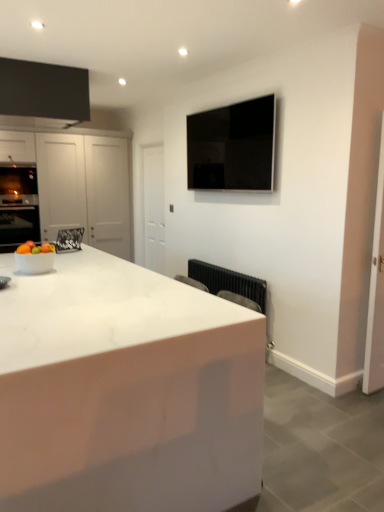
In order to face black glossy tv at upper center, should I rotate leftwards or rightwards?

It's best to rotate right around 4.133 degrees.

Where is `shiny white bowl at left`? The width and height of the screenshot is (384, 512). shiny white bowl at left is located at coordinates (35, 248).

What is the approximate width of black metallic radiator at lower center?

It is 6.21 inches.

The height and width of the screenshot is (512, 384). Find the location of `white glossy cabinet at left`. white glossy cabinet at left is located at coordinates (86, 189).

The height and width of the screenshot is (512, 384). In order to click on white marble countertop at center in this screenshot , I will do `click(126, 390)`.

Looking at their sizes, would you say white glossy cabinet at left is wider or thinner than white marble countertop at center?

white glossy cabinet at left is thinner than white marble countertop at center.

Which of these two, white glossy cabinet at left or white marble countertop at center, is smaller?

Smaller between the two is white glossy cabinet at left.

Is point (39, 144) closer or farther from the camera than point (40, 490)?

Point (39, 144) is positioned farther from the camera compared to point (40, 490).

How different are the orientations of white glossy cabinet at left and white marble countertop at center in degrees?

There is a 0.356-degree angle between the facing directions of white glossy cabinet at left and white marble countertop at center.

Which is more to the right, white glossy cabinet at left or shiny white bowl at left?

From the viewer's perspective, shiny white bowl at left appears more on the right side.

How many degrees apart are the facing directions of white glossy cabinet at left and shiny white bowl at left?

They differ by 180 degrees in their facing directions.

From the picture: How far apart are white glossy cabinet at left and shiny white bowl at left?

white glossy cabinet at left and shiny white bowl at left are 2.89 meters apart.

Considering the relative sizes of white glossy cabinet at left and shiny white bowl at left in the image provided, is white glossy cabinet at left taller than shiny white bowl at left?

Indeed, white glossy cabinet at left has a greater height compared to shiny white bowl at left.

Which is in front, point (112, 193) or point (199, 123)?

Positioned in front is point (199, 123).

Are white glossy cabinet at left and black glossy tv at upper center far apart?

Yes, white glossy cabinet at left and black glossy tv at upper center are located far from each other.

Considering the positions of objects white glossy cabinet at left and black glossy tv at upper center in the image provided, who is in front, white glossy cabinet at left or black glossy tv at upper center?

black glossy tv at upper center.

Who is smaller, white glossy cabinet at left or white glossy bowl at lower left?

With smaller size is white glossy bowl at lower left.

From the image's perspective, is white glossy cabinet at left beneath white glossy bowl at lower left?

No, from the image's perspective, white glossy cabinet at left is not beneath white glossy bowl at lower left.

Can you confirm if white glossy cabinet at left is shorter than white glossy bowl at lower left?

In fact, white glossy cabinet at left may be taller than white glossy bowl at lower left.

Where is `bowl on the right of the white glossy cabinet at left`? This screenshot has height=512, width=384. bowl on the right of the white glossy cabinet at left is located at coordinates click(35, 262).

Considering the positions of objects shiny white bowl at left and white marble countertop at center in the image provided, who is more to the right, shiny white bowl at left or white marble countertop at center?

From the viewer's perspective, white marble countertop at center appears more on the right side.

From a real-world perspective, is shiny white bowl at left positioned above or below white marble countertop at center?

In terms of real-world spatial position, shiny white bowl at left is above white marble countertop at center.

Would you consider shiny white bowl at left to be distant from white marble countertop at center?

Absolutely, shiny white bowl at left is distant from white marble countertop at center.

Can you confirm if white marble countertop at center is bigger than shiny white bowl at left?

Yes.

Can you confirm if white marble countertop at center is shorter than shiny white bowl at left?

No.

Are white marble countertop at center and shiny white bowl at left beside each other?

No, white marble countertop at center is not making contact with shiny white bowl at left.

From a real-world perspective, which object rests below the other?

From a 3D spatial view, white marble countertop at center is below.

You are a GUI agent. You are given a task and a screenshot of the screen. Output one action in this format:
    pyautogui.click(x=<x>, y=<y>)
    Task: Click on the fruit on the left of black glossy tv at upper center
    The image size is (384, 512).
    Given the screenshot: What is the action you would take?
    pyautogui.click(x=35, y=248)

From the image's perspective, which is above, shiny white bowl at left or black glossy tv at upper center?

black glossy tv at upper center, from the image's perspective.

Considering the sizes of objects shiny white bowl at left and black glossy tv at upper center in the image provided, who is taller, shiny white bowl at left or black glossy tv at upper center?

With more height is black glossy tv at upper center.

Does shiny white bowl at left have a lesser width compared to black glossy tv at upper center?

In fact, shiny white bowl at left might be wider than black glossy tv at upper center.

Where is `cabinetry lying behind the white marble countertop at center`? The width and height of the screenshot is (384, 512). cabinetry lying behind the white marble countertop at center is located at coordinates (86, 189).

At what (x,y) coordinates should I click in order to perform the action: click on cabinetry above the shiny white bowl at left (from a real-world perspective). Please return your answer as a coordinate pair (x, y). The height and width of the screenshot is (512, 384). Looking at the image, I should click on (86, 189).

Estimate the real-world distances between objects in this image. Which object is closer to black metallic radiator at lower center, shiny white bowl at left or white marble countertop at center?

The object closer to black metallic radiator at lower center is white marble countertop at center.

Which object lies nearer to the anchor point black metallic radiator at lower center, shiny white bowl at left or white glossy cabinet at left?

shiny white bowl at left.

Considering their positions, is shiny white bowl at left positioned closer to white glossy cabinet at left than black metallic radiator at lower center?

The object closer to white glossy cabinet at left is black metallic radiator at lower center.

Based on their spatial positions, is white marble countertop at center or white glossy bowl at lower left further from white glossy cabinet at left?

white marble countertop at center.

In the scene shown: From the image, which object appears to be nearer to white glossy cabinet at left, black metallic radiator at lower center or white marble countertop at center?

black metallic radiator at lower center is positioned closer to the anchor white glossy cabinet at left.

When comparing their distances from shiny white bowl at left, does black glossy tv at upper center or white glossy cabinet at left seem further?

white glossy cabinet at left is positioned further to the anchor shiny white bowl at left.

Considering their positions, is white glossy cabinet at left positioned further to white marble countertop at center than white glossy bowl at lower left?

The object further to white marble countertop at center is white glossy cabinet at left.

Based on their spatial positions, is white glossy cabinet at left or black metallic radiator at lower center closer to white marble countertop at center?

The object closer to white marble countertop at center is black metallic radiator at lower center.

This screenshot has width=384, height=512. Find the location of `radiator between shiny white bowl at left and black glossy tv at upper center in the horizontal direction`. radiator between shiny white bowl at left and black glossy tv at upper center in the horizontal direction is located at coordinates (230, 284).

You are a GUI agent. You are given a task and a screenshot of the screen. Output one action in this format:
    pyautogui.click(x=<x>, y=<y>)
    Task: Click on the bowl between white marble countertop at center and black metallic radiator at lower center in the front-back direction
    The image size is (384, 512).
    Given the screenshot: What is the action you would take?
    pyautogui.click(x=35, y=262)

Locate an element on the screen. The width and height of the screenshot is (384, 512). bowl between shiny white bowl at left and black glossy tv at upper center from left to right is located at coordinates (35, 262).

This screenshot has height=512, width=384. I want to click on radiator between white glossy cabinet at left and black glossy tv at upper center in the horizontal direction, so click(x=230, y=284).